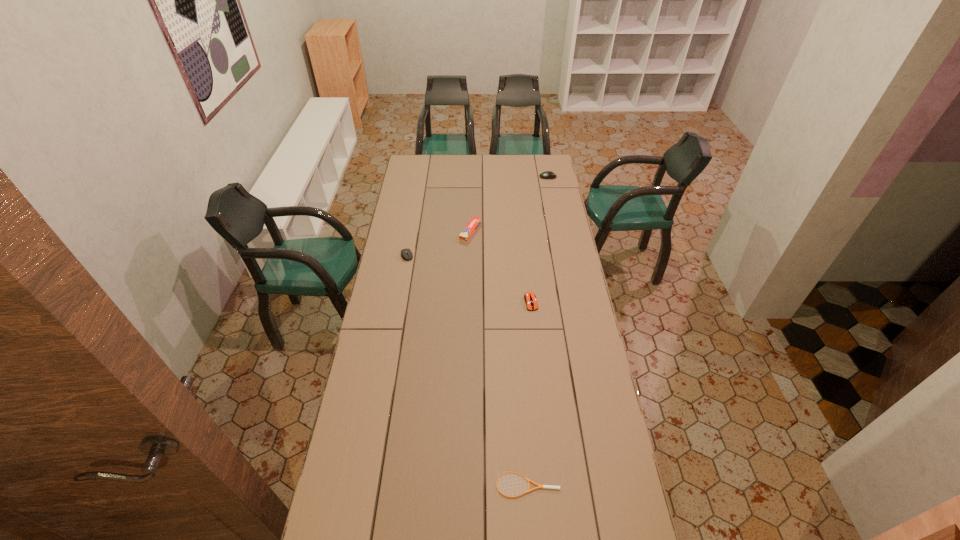
You are a GUI agent. You are given a task and a screenshot of the screen. Output one action in this format:
    pyautogui.click(x=<x>, y=<y>)
    Task: Click on the free location that satisfies the following two spatial constraints: 1. on the wheel side of the rightmost computer mouse; 2. on the front side of the tennis racket
    This screenshot has width=960, height=540.
    Given the screenshot: What is the action you would take?
    point(609,484)

Where is `vacant space that satisfies the following two spatial constraints: 1. on the wheel side of the rightmost object; 2. on the front side of the fourth farthest object`? The width and height of the screenshot is (960, 540). vacant space that satisfies the following two spatial constraints: 1. on the wheel side of the rightmost object; 2. on the front side of the fourth farthest object is located at coordinates (573, 302).